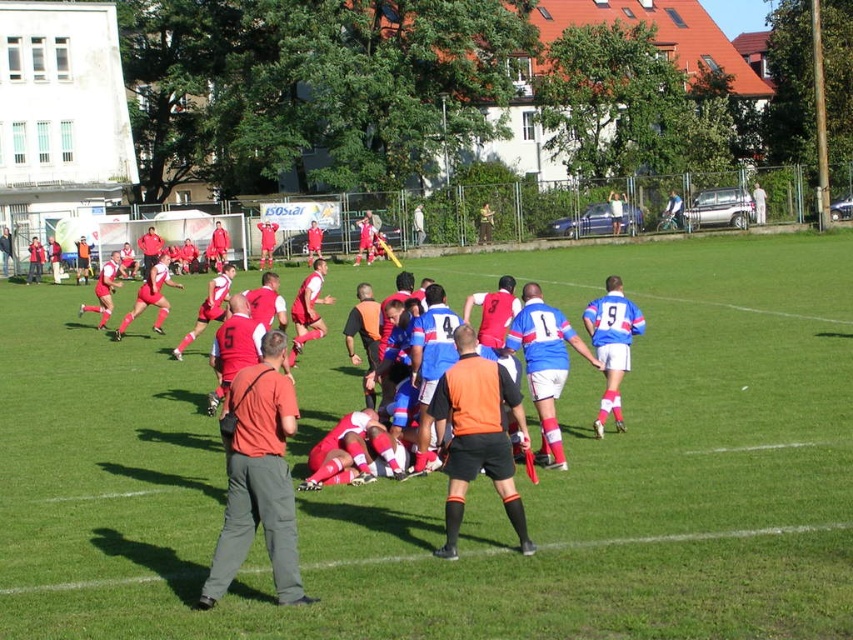
You are a referee at the rugby match. You see an orange shirt at center and an orange mesh vest at center on the field. Which piece of clothing is wider?

The orange shirt at center is wider than the orange mesh vest at center because the orange shirt at center has a greater width as stated in the description.